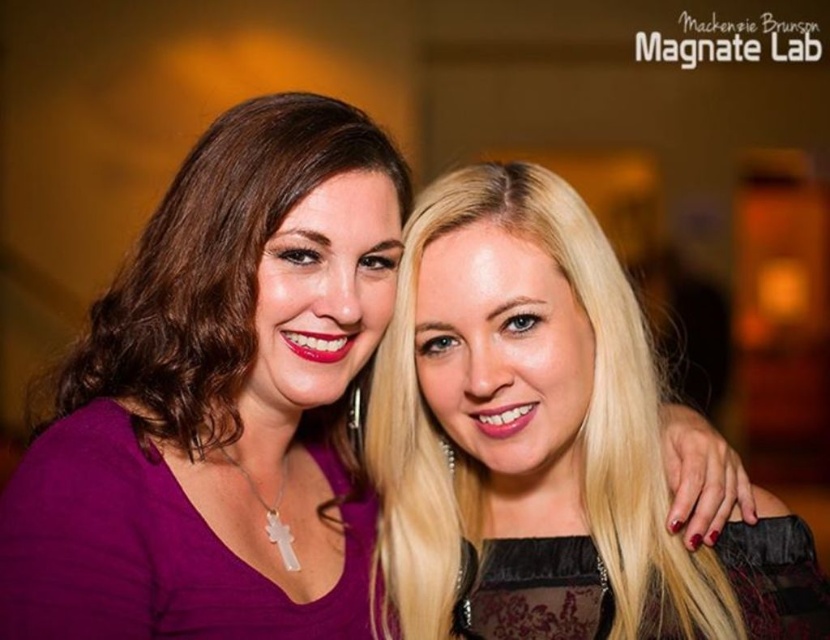
You are a photographer trying to adjust the lighting for a portrait. You notice two women in the scene. The woman on the left has brown hair and a purple top, while the woman on the right has blonde hair and a black outfit. You want to ensure that the lighting is balanced between them. If the point representing the blonde hair at right is located at coordinates point (545, 444), where would you position the light to evenly illuminate both subjects?

To evenly illuminate both subjects, position the light so that it is equidistant from both women. Since the blonde hair at right is represented by point (545, 444), place the light midway between the two women, ensuring it faces both equally.

You are a photographer standing in front of the two women. You want to adjust your camera to focus on the blonde hair at right. What is the minimum focusing distance your camera should have to capture it clearly?

The minimum focusing distance your camera should have is at least 37.04 inches to capture the blonde hair at right clearly.

You are a photographer trying to adjust the lighting for a portrait. You notice the matte purple blouse at left and the blonde hair at right. Which object is closer to the camera lens?

The blonde hair at right is closer to the camera lens because the matte purple blouse at left is behind it.